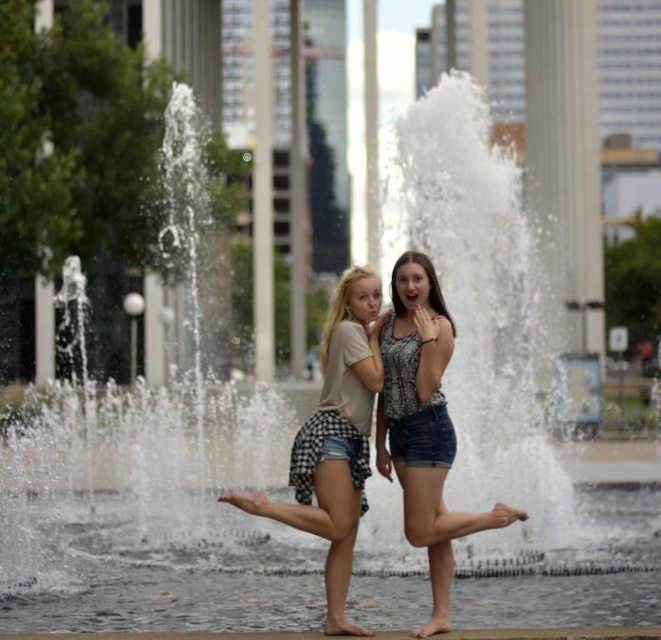
Does patterned fabric top at center lie in front of checkered denim shorts at center?

Yes, patterned fabric top at center is in front of checkered denim shorts at center.

Consider the image. Who is more forward, (420, 292) or (330, 492)?

Positioned in front is point (330, 492).

Is point (446, 353) farther from viewer compared to point (352, 348)?

No, (446, 353) is in front of (352, 348).

Locate an element on the screen. The width and height of the screenshot is (661, 640). patterned fabric top at center is located at coordinates (422, 426).